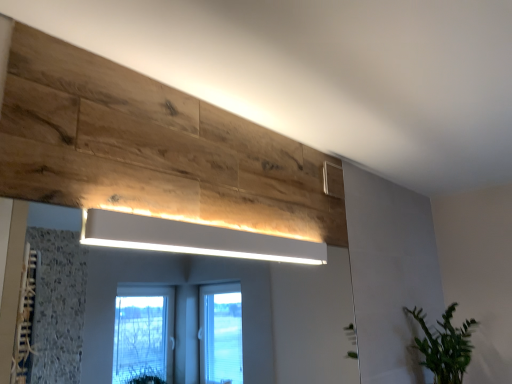
Question: From the image's perspective, is white matte rectangular light fixture at upper center positioned above or below green leafy plant at lower right?

Choices:
 (A) above
 (B) below

Answer: (A)

Question: Is white matte rectangular light fixture at upper center taller or shorter than green leafy plant at lower right?

Choices:
 (A) tall
 (B) short

Answer: (B)

Question: Based on their positions, is white matte rectangular light fixture at upper center located to the left or right of green leafy plant at lower right?

Choices:
 (A) left
 (B) right

Answer: (A)

Question: Considering the positions of green leafy plant at lower right and white matte rectangular light fixture at upper center in the image, is green leafy plant at lower right bigger or smaller than white matte rectangular light fixture at upper center?

Choices:
 (A) small
 (B) big

Answer: (B)

Question: Is green leafy plant at lower right wider or thinner than white matte rectangular light fixture at upper center?

Choices:
 (A) thin
 (B) wide

Answer: (B)

Question: Which is correct: green leafy plant at lower right is inside white matte rectangular light fixture at upper center, or outside of it?

Choices:
 (A) outside
 (B) inside

Answer: (A)

Question: From their relative heights in the image, would you say green leafy plant at lower right is taller or shorter than white matte rectangular light fixture at upper center?

Choices:
 (A) short
 (B) tall

Answer: (B)